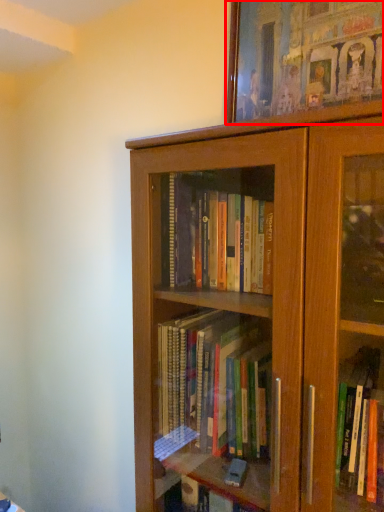
Question: From the image's perspective, where is picture frame (annotated by the red box) located relative to bookcase?

Choices:
 (A) above
 (B) below

Answer: (A)